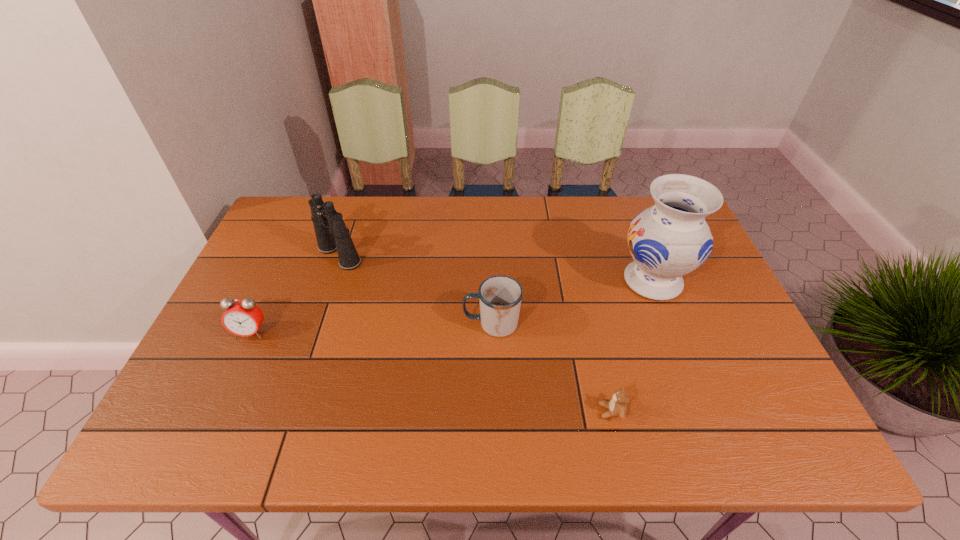
This screenshot has height=540, width=960. What are the coordinates of `vacant region located on the handle side of the mug` in the screenshot? It's located at (394, 323).

This screenshot has width=960, height=540. Identify the location of free space located on the handle side of the mug. (401, 323).

Identify the location of vacant region located on the handle side of the mug. The height and width of the screenshot is (540, 960). pyautogui.click(x=428, y=323).

This screenshot has width=960, height=540. What are the coordinates of `free space located on the front-facing side of the alarm clock` in the screenshot? It's located at (230, 379).

Find the location of a particular element. free point located 0.090m on the front-facing side of the second object from right to left is located at coordinates (559, 411).

Locate an element on the screen. Image resolution: width=960 pixels, height=540 pixels. vacant space situated 0.060m on the front-facing side of the second object from right to left is located at coordinates (572, 411).

Where is `free spot located on the front-facing side of the second object from right to left`? This screenshot has width=960, height=540. free spot located on the front-facing side of the second object from right to left is located at coordinates (445, 411).

In order to click on object present at the far edge in this screenshot , I will do `click(332, 235)`.

Where is `object located at the near edge`? This screenshot has height=540, width=960. object located at the near edge is located at coordinates (617, 405).

The image size is (960, 540). Identify the location of object that is at the left edge. (243, 318).